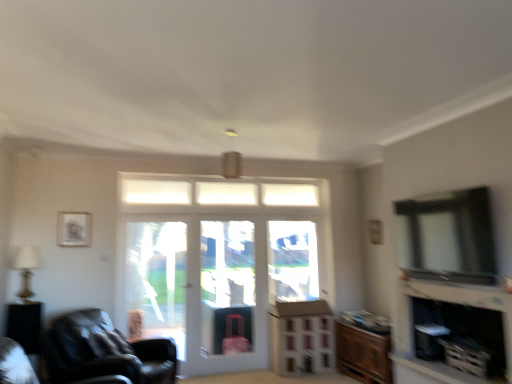
This screenshot has height=384, width=512. In order to click on leather black chair at lower left, acting as the second chair starting from the front in this screenshot , I will do `click(103, 351)`.

What is the approximate width of leather couch at lower left, the 2th chair viewed from the back?

The width of leather couch at lower left, the 2th chair viewed from the back, is 1.04 meters.

Identify the location of matte silver lamp at left. (27, 269).

At what (x,y) coordinates should I click in order to perform the action: click on leather black chair at lower left, acting as the second chair starting from the front. Please return your answer as a coordinate pair (x, y). The width and height of the screenshot is (512, 384). Looking at the image, I should click on (103, 351).

Considering the sizes of objects matte white picture frame at upper left and transparent glass window at upper right in the image provided, who is smaller, matte white picture frame at upper left or transparent glass window at upper right?

matte white picture frame at upper left.

In the scene shown: From the image's perspective, does matte white picture frame at upper left appear lower than transparent glass window at upper right?

Yes, from the image's perspective, matte white picture frame at upper left is beneath transparent glass window at upper right.

Is there a large distance between matte white picture frame at upper left and transparent glass window at upper right?

Absolutely, matte white picture frame at upper left is distant from transparent glass window at upper right.

Does point (14, 381) lie in front of point (222, 260)?

Yes, point (14, 381) is closer to viewer.

Is leather couch at lower left, positioned as the first chair in front-to-back order, oriented towards clear glass screen door at center?

No, leather couch at lower left, positioned as the first chair in front-to-back order, is not facing towards clear glass screen door at center.

Does leather couch at lower left, positioned as the first chair in front-to-back order, come behind clear glass screen door at center?

No, the depth of leather couch at lower left, positioned as the first chair in front-to-back order, is less than that of clear glass screen door at center.

Is the surface of leather couch at lower left, positioned as the first chair in front-to-back order, in direct contact with white glossy door at center?

No, leather couch at lower left, positioned as the first chair in front-to-back order, is not next to white glossy door at center.

Is leather couch at lower left, the 2th chair viewed from the back, to the left of white glossy door at center from the viewer's perspective?

Yes, leather couch at lower left, the 2th chair viewed from the back, is to the left of white glossy door at center.

Is leather couch at lower left, the 2th chair viewed from the back, not within white glossy door at center?

Yes, leather couch at lower left, the 2th chair viewed from the back, is located beyond the bounds of white glossy door at center.

Find the location of a particular element. This screenshot has height=384, width=512. the 1st chair below the white glossy door at center (from a real-world perspective) is located at coordinates (15, 364).

Are black glossy side table at lower left and brown cardboard dresser at lower center far apart?

Yes, black glossy side table at lower left and brown cardboard dresser at lower center are located far from each other.

In terms of height, does black glossy side table at lower left look taller or shorter compared to brown cardboard dresser at lower center?

Answer: Considering their sizes, black glossy side table at lower left has less height than brown cardboard dresser at lower center.

The width and height of the screenshot is (512, 384). I want to click on dresser lying behind the black glossy side table at lower left, so click(x=301, y=337).

Measure the distance from black glossy side table at lower left to brown cardboard dresser at lower center.

3.04 meters.

From the image's perspective, relative to wooden cabinet at lower right, is white glossy door at center above or below?

From the image's perspective, white glossy door at center appears above wooden cabinet at lower right.

Consider the image. Between white glossy door at center and wooden cabinet at lower right, which one appears on the right side from the viewer's perspective?

wooden cabinet at lower right.

From a real-world perspective, does white glossy door at center sit lower than wooden cabinet at lower right?

No, from a real-world perspective, white glossy door at center is not under wooden cabinet at lower right.

Considering the points (214, 357) and (381, 347), which point is behind, point (214, 357) or point (381, 347)?

Point (214, 357)

From a real-world perspective, which object stands above the other?

In real-world perspective, clear glass screen door at center is above.

Is clear glass screen door at center placed right next to wooden cabinet at lower right?

No, clear glass screen door at center is not beside wooden cabinet at lower right.

Is the position of clear glass screen door at center less distant than that of wooden cabinet at lower right?

No, clear glass screen door at center is further to the viewer.

How many degrees apart are the facing directions of clear glass screen door at center and wooden cabinet at lower right?

88.5 degrees.

In terms of size, does transparent glass window at upper right appear bigger or smaller than brown cardboard dresser at lower center?

transparent glass window at upper right is smaller than brown cardboard dresser at lower center.

This screenshot has width=512, height=384. In order to click on dresser that appears behind the transparent glass window at upper right in this screenshot , I will do `click(301, 337)`.

Can you see transparent glass window at upper right touching brown cardboard dresser at lower center?

No, transparent glass window at upper right is not touching brown cardboard dresser at lower center.

Based on the photo, from a real-world perspective, which is physically above, transparent glass window at upper right or brown cardboard dresser at lower center?

In real-world perspective, transparent glass window at upper right is above.

The width and height of the screenshot is (512, 384). Identify the location of picture frame behind the transparent glass window at upper right. (74, 229).

Where is `chair that is the 2nd object located in front of the clear glass screen door at center`? The width and height of the screenshot is (512, 384). chair that is the 2nd object located in front of the clear glass screen door at center is located at coordinates (15, 364).

Estimate the real-world distances between objects in this image. Which object is further from brown cardboard dresser at lower center, leather black chair at lower left, which is the 1th chair from back to front, or leather couch at lower left, the 2th chair viewed from the back?

leather couch at lower left, the 2th chair viewed from the back, is positioned further to the anchor brown cardboard dresser at lower center.

Looking at the image, which one is located closer to wooden cabinet at lower right, leather couch at lower left, positioned as the first chair in front-to-back order, or white glossy door at center?

white glossy door at center.

Estimate the real-world distances between objects in this image. Which object is closer to transparent glass window at upper right, black glossy side table at lower left or leather black chair at lower left, which is the 1th chair from back to front?

The object closer to transparent glass window at upper right is leather black chair at lower left, which is the 1th chair from back to front.

Estimate the real-world distances between objects in this image. Which object is further from leather couch at lower left, positioned as the first chair in front-to-back order, leather black chair at lower left, which is the 1th chair from back to front, or transparent glass window at upper right?

The object further to leather couch at lower left, positioned as the first chair in front-to-back order, is transparent glass window at upper right.

Looking at the image, which one is located further to brown cardboard dresser at lower center, white glossy door at center or matte black fireplace at lower right?

matte black fireplace at lower right lies further to brown cardboard dresser at lower center than the other object.

Estimate the real-world distances between objects in this image. Which object is closer to wooden cabinet at lower right, matte white picture frame at upper left or matte silver lamp at left?

matte white picture frame at upper left is positioned closer to the anchor wooden cabinet at lower right.

Consider the image. Looking at the image, which one is located further to transparent glass window at upper right, matte silver lamp at left or brown cardboard dresser at lower center?

matte silver lamp at left is positioned further to the anchor transparent glass window at upper right.

From the picture: Estimate the real-world distances between objects in this image. Which object is further from transparent glass window at upper right, matte white picture frame at upper left or leather couch at lower left, positioned as the first chair in front-to-back order?

matte white picture frame at upper left is positioned further to the anchor transparent glass window at upper right.

The width and height of the screenshot is (512, 384). In order to click on door between clear glass screen door at center and brown cardboard dresser at lower center in this screenshot , I will do `click(218, 261)`.

The image size is (512, 384). What are the coordinates of `door between matte white picture frame at upper left and matte black fireplace at lower right in the horizontal direction` in the screenshot? It's located at (218, 261).

Locate an element on the screen. The height and width of the screenshot is (384, 512). window between matte white picture frame at upper left and matte black fireplace at lower right in the horizontal direction is located at coordinates (447, 236).

I want to click on window between leather couch at lower left, positioned as the first chair in front-to-back order, and matte black fireplace at lower right, in the horizontal direction, so click(447, 236).